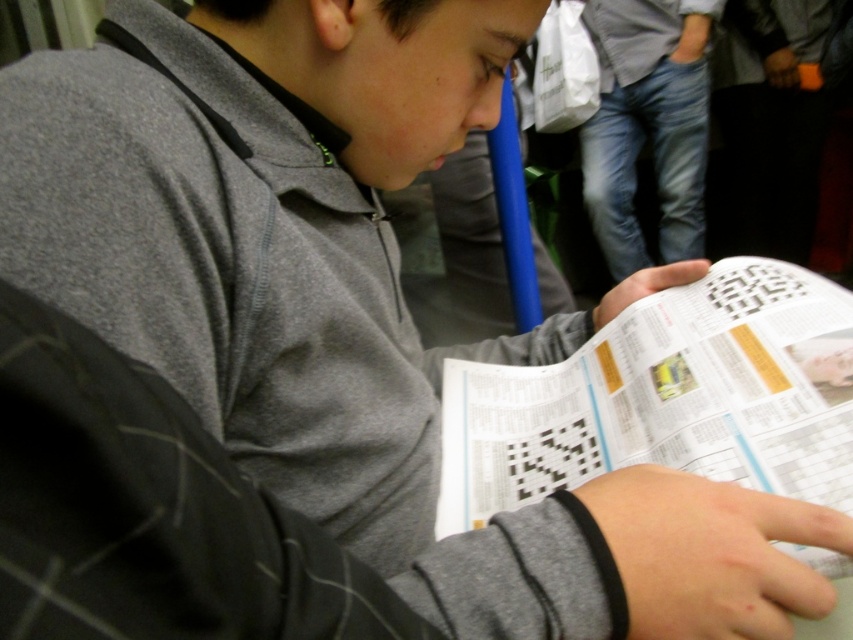
Does white paper at center have a greater height compared to jeans at right?

In fact, white paper at center may be shorter than jeans at right.

Is point (807, 339) less distant than point (666, 128)?

Yes, it is.

Describe the element at coordinates (666, 397) in the screenshot. This screenshot has width=853, height=640. I see `white paper at center` at that location.

At what (x,y) coordinates should I click in order to perform the action: click on white paper at center. Please return your answer as a coordinate pair (x, y). Image resolution: width=853 pixels, height=640 pixels. Looking at the image, I should click on (666, 397).